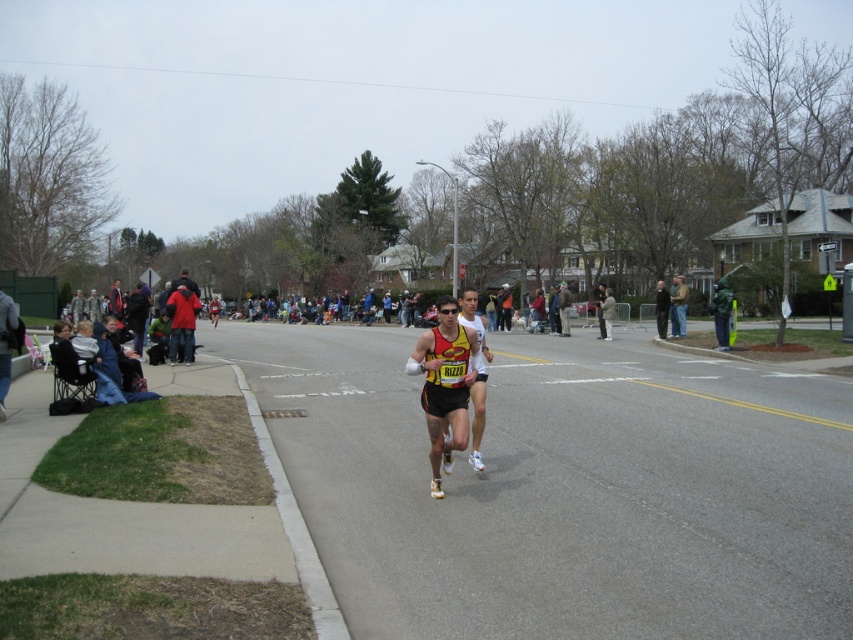
Image resolution: width=853 pixels, height=640 pixels. Describe the element at coordinates (566, 488) in the screenshot. I see `black running suit at center` at that location.

Does black running suit at center have a lesser height compared to yellow and black running suit at center?

Correct, black running suit at center is not as tall as yellow and black running suit at center.

Where is `black running suit at center`? Image resolution: width=853 pixels, height=640 pixels. black running suit at center is located at coordinates (566, 488).

Does point (503, 483) come closer to viewer compared to point (560, 321)?

Yes, it is.

Does point (498, 380) lie behind point (567, 314)?

That is False.

The image size is (853, 640). I want to click on black running suit at center, so click(566, 488).

Measure the distance between yellow and black running suit at center and yellow jersey at center.

yellow and black running suit at center is 20.93 meters away from yellow jersey at center.

Can you confirm if yellow and black running suit at center is thinner than yellow jersey at center?

Yes, yellow and black running suit at center is thinner than yellow jersey at center.

You are a GUI agent. You are given a task and a screenshot of the screen. Output one action in this format:
    pyautogui.click(x=<x>, y=<y>)
    Task: Click on the yellow and black running suit at center
    Image resolution: width=853 pixels, height=640 pixels.
    Given the screenshot: What is the action you would take?
    pyautogui.click(x=444, y=385)